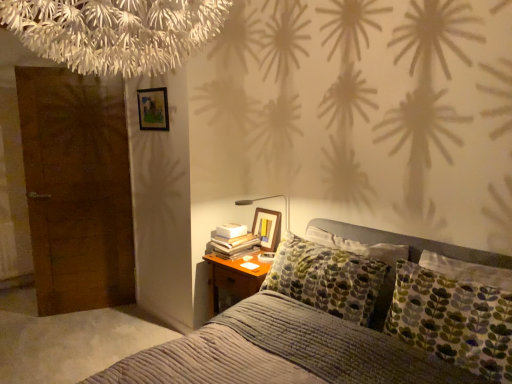
Question: From a real-world perspective, is textured gray bed at center under white paper book at bedside?

Choices:
 (A) no
 (B) yes

Answer: (B)

Question: From the image's perspective, does textured gray bed at center appear lower than white paper book at bedside?

Choices:
 (A) no
 (B) yes

Answer: (B)

Question: Considering the relative positions of textured gray bed at center and white paper book at bedside in the image provided, is textured gray bed at center in front of white paper book at bedside?

Choices:
 (A) no
 (B) yes

Answer: (B)

Question: From the image's perspective, would you say textured gray bed at center is positioned over white paper book at bedside?

Choices:
 (A) yes
 (B) no

Answer: (B)

Question: Would you consider textured gray bed at center to be distant from white paper book at bedside?

Choices:
 (A) no
 (B) yes

Answer: (A)

Question: Could you tell me if textured gray bed at center is turned towards white paper book at bedside?

Choices:
 (A) no
 (B) yes

Answer: (A)

Question: Would you say brown wooden door at left is a long distance from white paper book at bedside?

Choices:
 (A) no
 (B) yes

Answer: (B)

Question: Is brown wooden door at left to the right of white paper book at bedside from the viewer's perspective?

Choices:
 (A) yes
 (B) no

Answer: (B)

Question: Is brown wooden door at left oriented away from white paper book at bedside?

Choices:
 (A) yes
 (B) no

Answer: (B)

Question: Is brown wooden door at left taller than white paper book at bedside?

Choices:
 (A) no
 (B) yes

Answer: (B)

Question: Can you confirm if brown wooden door at left is shorter than white paper book at bedside?

Choices:
 (A) no
 (B) yes

Answer: (A)

Question: Can you confirm if brown wooden door at left is thinner than white paper book at bedside?

Choices:
 (A) yes
 (B) no

Answer: (A)

Question: Considering the relative sizes of white paper book at bedside and textured gray bed at center in the image provided, is white paper book at bedside bigger than textured gray bed at center?

Choices:
 (A) yes
 (B) no

Answer: (B)